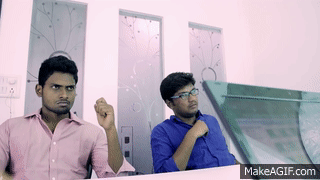
Find the location of a particular element. This screenshot has width=320, height=180. windows in first frame is located at coordinates (59, 32), (134, 53), (202, 52).